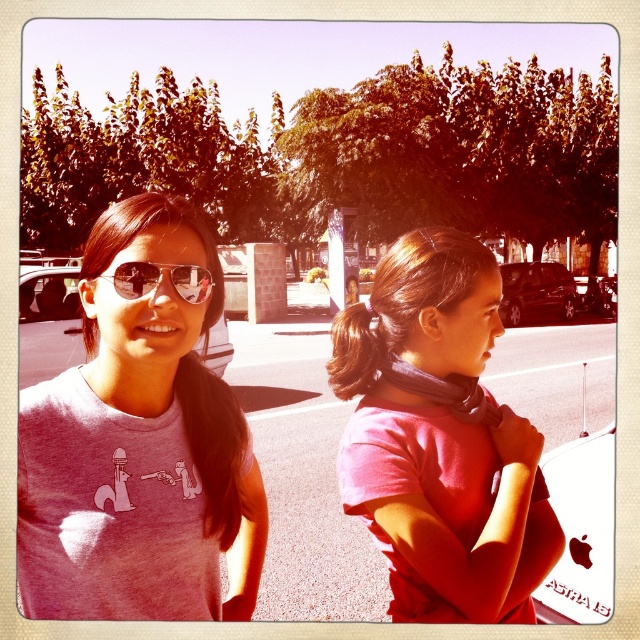
Between point (92, 540) and point (419, 460), which one is positioned behind?

The point (419, 460) is more distant.

What do you see at coordinates (140, 440) in the screenshot? Image resolution: width=640 pixels, height=640 pixels. I see `pink cotton t-shirt at center` at bounding box center [140, 440].

Does point (99, 570) lie in front of point (502, 474)?

Yes, point (99, 570) is in front of point (502, 474).

Where is `pink cotton t-shirt at center`? Image resolution: width=640 pixels, height=640 pixels. pink cotton t-shirt at center is located at coordinates (140, 440).

Is pink cotton t-shirt at center taller than matte black sunglasses at upper left?

Correct, pink cotton t-shirt at center is much taller as matte black sunglasses at upper left.

Which is behind, point (140, 470) or point (196, 278)?

Positioned behind is point (196, 278).

You are a GUI agent. You are given a task and a screenshot of the screen. Output one action in this format:
    pyautogui.click(x=<x>, y=<y>)
    Task: Click on the pink cotton t-shirt at center
    The width and height of the screenshot is (640, 640).
    Given the screenshot: What is the action you would take?
    pyautogui.click(x=140, y=440)

Does pink matte scarf at center have a greater width compared to matte black sunglasses at upper left?

Indeed, pink matte scarf at center has a greater width compared to matte black sunglasses at upper left.

Can you confirm if pink matte scarf at center is positioned above matte black sunglasses at upper left?

No, pink matte scarf at center is not above matte black sunglasses at upper left.

Is point (387, 326) closer to viewer compared to point (131, 284)?

No, it is not.

Where is `pink matte scarf at center`? pink matte scarf at center is located at coordinates (440, 440).